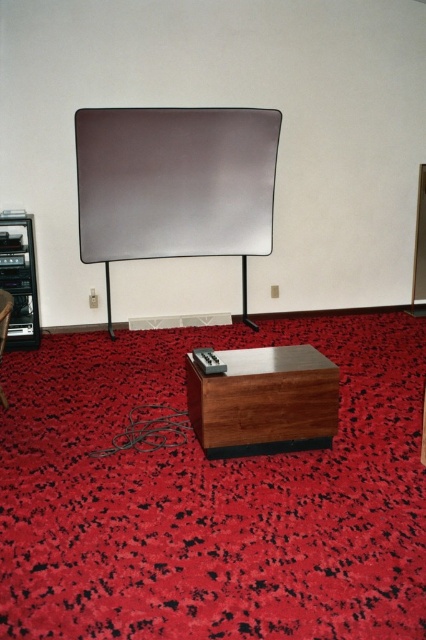
Question: Does wooden side table at lower center have a greater width compared to metallic black entertainment center at left?

Choices:
 (A) no
 (B) yes

Answer: (B)

Question: Among these points, which one is farthest from the camera?

Choices:
 (A) (20, 301)
 (B) (8, 294)

Answer: (A)

Question: Is matte silver screen at center below wooden side table at lower center?

Choices:
 (A) no
 (B) yes

Answer: (A)

Question: Which object is closer to the camera taking this photo?

Choices:
 (A) matte silver screen at center
 (B) metallic black entertainment center at left
 (C) wooden side table at lower center

Answer: (C)

Question: Which of the following is the closest to the observer?

Choices:
 (A) (11, 246)
 (B) (193, 182)
 (C) (222, 435)
 (D) (0, 304)

Answer: (C)

Question: Does wooden side table at lower center have a larger size compared to metallic black entertainment center at left?

Choices:
 (A) yes
 (B) no

Answer: (A)